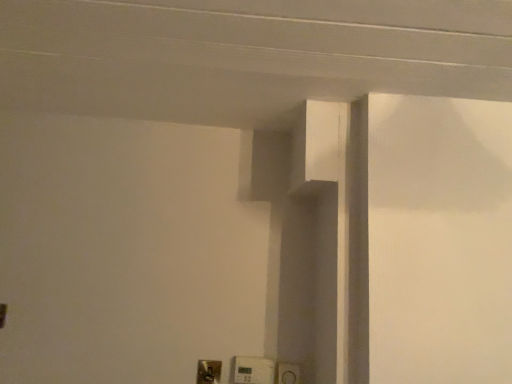
From the picture: How much space does white plastic light switch at lower center, which ranks as the first light switch in right-to-left order, occupy vertically?

The height of white plastic light switch at lower center, which ranks as the first light switch in right-to-left order, is 4.23 inches.

Find the location of a particular element. The image size is (512, 384). white plastic light switch at lower center, placed as the second light switch when sorted from left to right is located at coordinates (253, 370).

The image size is (512, 384). What do you see at coordinates (253, 370) in the screenshot?
I see `white plastic light switch at lower center, placed as the second light switch when sorted from left to right` at bounding box center [253, 370].

What do you see at coordinates (209, 372) in the screenshot?
I see `white plastic light switch at lower center, arranged as the second light switch when viewed from the right` at bounding box center [209, 372].

Where is `white plastic light switch at lower center, the 1th light switch from the left`? The height and width of the screenshot is (384, 512). white plastic light switch at lower center, the 1th light switch from the left is located at coordinates 209,372.

Identify the location of white plastic light switch at lower center, which ranks as the first light switch in right-to-left order. The image size is (512, 384). (253, 370).

Can you confirm if white plastic light switch at lower center, the 1th light switch from the left, is positioned to the left of white plastic light switch at lower center, placed as the second light switch when sorted from left to right?

Yes, white plastic light switch at lower center, the 1th light switch from the left, is to the left of white plastic light switch at lower center, placed as the second light switch when sorted from left to right.

Is white plastic light switch at lower center, the 1th light switch from the left, closer to camera compared to white plastic light switch at lower center, placed as the second light switch when sorted from left to right?

No.

Between point (217, 382) and point (242, 359), which one is positioned in front?

The point (217, 382) is more forward.

From the image's perspective, is white plastic light switch at lower center, arranged as the second light switch when viewed from the right, above or below white plastic light switch at lower center, placed as the second light switch when sorted from left to right?

Based on their image positions, white plastic light switch at lower center, arranged as the second light switch when viewed from the right, is located beneath white plastic light switch at lower center, placed as the second light switch when sorted from left to right.

From a real-world perspective, is white plastic light switch at lower center, the 1th light switch from the left, positioned under white plastic light switch at lower center, placed as the second light switch when sorted from left to right, based on gravity?

Yes.

Considering the sizes of white plastic light switch at lower center, the 1th light switch from the left, and white plastic light switch at lower center, which ranks as the first light switch in right-to-left order, in the image, is white plastic light switch at lower center, the 1th light switch from the left, wider or thinner than white plastic light switch at lower center, which ranks as the first light switch in right-to-left order,?

In the image, white plastic light switch at lower center, the 1th light switch from the left, appears to be more narrow than white plastic light switch at lower center, which ranks as the first light switch in right-to-left order.

From their relative heights in the image, would you say white plastic light switch at lower center, the 1th light switch from the left, is taller or shorter than white plastic light switch at lower center, which ranks as the first light switch in right-to-left order?

In the image, white plastic light switch at lower center, the 1th light switch from the left, appears to be shorter than white plastic light switch at lower center, which ranks as the first light switch in right-to-left order.

Can you confirm if white plastic light switch at lower center, the 1th light switch from the left, is smaller than white plastic light switch at lower center, placed as the second light switch when sorted from left to right?

Indeed, white plastic light switch at lower center, the 1th light switch from the left, has a smaller size compared to white plastic light switch at lower center, placed as the second light switch when sorted from left to right.

Is white plastic light switch at lower center, placed as the second light switch when sorted from left to right, surrounded by white plastic light switch at lower center, arranged as the second light switch when viewed from the right?

No, white plastic light switch at lower center, placed as the second light switch when sorted from left to right, is not inside white plastic light switch at lower center, arranged as the second light switch when viewed from the right.

Would you consider white plastic light switch at lower center, arranged as the second light switch when viewed from the right, to be distant from white plastic light switch at lower center, which ranks as the first light switch in right-to-left order?

That's not correct — white plastic light switch at lower center, arranged as the second light switch when viewed from the right, is a little close to white plastic light switch at lower center, which ranks as the first light switch in right-to-left order.

Is white plastic light switch at lower center, arranged as the second light switch when viewed from the right, looking in the opposite direction of white plastic light switch at lower center, placed as the second light switch when sorted from left to right?

No, white plastic light switch at lower center, arranged as the second light switch when viewed from the right, is not facing away from white plastic light switch at lower center, placed as the second light switch when sorted from left to right.

Identify the location of light switch that is in front of the white plastic light switch at lower center, arranged as the second light switch when viewed from the right. The height and width of the screenshot is (384, 512). (253, 370).

Does white plastic light switch at lower center, which ranks as the first light switch in right-to-left order, appear on the right side of white plastic light switch at lower center, arranged as the second light switch when viewed from the right?

Yes, white plastic light switch at lower center, which ranks as the first light switch in right-to-left order, is to the right of white plastic light switch at lower center, arranged as the second light switch when viewed from the right.

Between white plastic light switch at lower center, placed as the second light switch when sorted from left to right, and white plastic light switch at lower center, the 1th light switch from the left, which one is positioned behind?

white plastic light switch at lower center, the 1th light switch from the left, is more distant.

Which point is more forward, (259,365) or (204,371)?

The point (204,371) is closer.

From the image's perspective, does white plastic light switch at lower center, which ranks as the first light switch in right-to-left order, appear higher than white plastic light switch at lower center, the 1th light switch from the left?

Yes, from the image's perspective, white plastic light switch at lower center, which ranks as the first light switch in right-to-left order, is above white plastic light switch at lower center, the 1th light switch from the left.

From a real-world perspective, which object stands above the other?

white plastic light switch at lower center, placed as the second light switch when sorted from left to right.

Consider the image. Considering the sizes of objects white plastic light switch at lower center, which ranks as the first light switch in right-to-left order, and white plastic light switch at lower center, arranged as the second light switch when viewed from the right, in the image provided, who is wider, white plastic light switch at lower center, which ranks as the first light switch in right-to-left order, or white plastic light switch at lower center, arranged as the second light switch when viewed from the right,?

white plastic light switch at lower center, which ranks as the first light switch in right-to-left order.

Who is shorter, white plastic light switch at lower center, placed as the second light switch when sorted from left to right, or white plastic light switch at lower center, the 1th light switch from the left?

With less height is white plastic light switch at lower center, the 1th light switch from the left.

Can you confirm if white plastic light switch at lower center, placed as the second light switch when sorted from left to right, is smaller than white plastic light switch at lower center, the 1th light switch from the left?

No, white plastic light switch at lower center, placed as the second light switch when sorted from left to right, is not smaller than white plastic light switch at lower center, the 1th light switch from the left.

Would you say white plastic light switch at lower center, placed as the second light switch when sorted from left to right, contains white plastic light switch at lower center, the 1th light switch from the left?

Definitely not — white plastic light switch at lower center, the 1th light switch from the left, is not inside white plastic light switch at lower center, placed as the second light switch when sorted from left to right.

Is white plastic light switch at lower center, which ranks as the first light switch in right-to-left order, placed right next to white plastic light switch at lower center, the 1th light switch from the left?

They are not placed beside each other.

Is white plastic light switch at lower center, placed as the second light switch when sorted from left to right, turned away from white plastic light switch at lower center, arranged as the second light switch when viewed from the right?

white plastic light switch at lower center, placed as the second light switch when sorted from left to right, does not have its back to white plastic light switch at lower center, arranged as the second light switch when viewed from the right.

Find the location of a particular element. light switch that appears above the white plastic light switch at lower center, the 1th light switch from the left (from the image's perspective) is located at coordinates (253, 370).

Where is `light switch lying in front of the white plastic light switch at lower center, arranged as the second light switch when viewed from the right`? light switch lying in front of the white plastic light switch at lower center, arranged as the second light switch when viewed from the right is located at coordinates (253, 370).

Identify the location of light switch on the right of white plastic light switch at lower center, the 1th light switch from the left. The width and height of the screenshot is (512, 384). (253, 370).